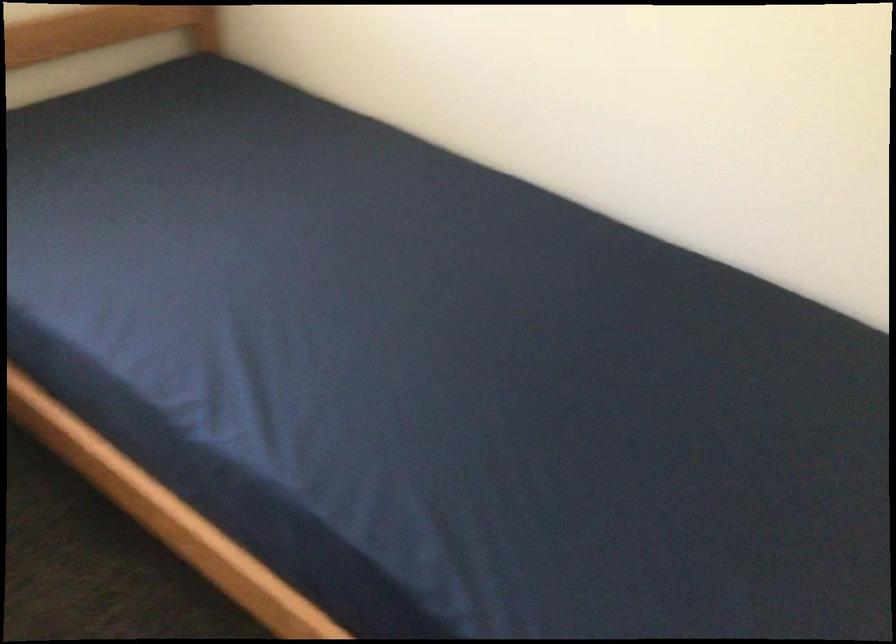
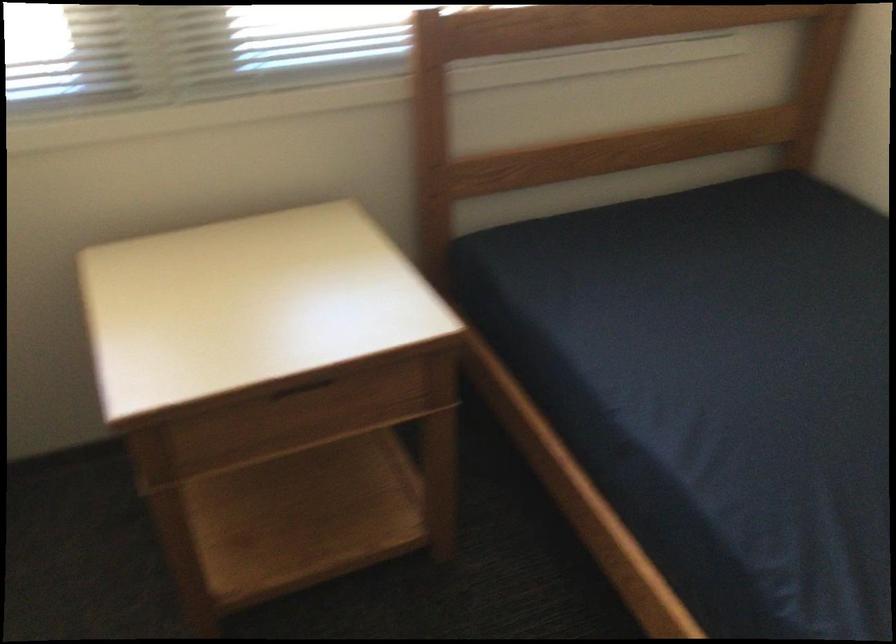
Question: How did the camera likely rotate?

Choices:
 (A) Left
 (B) Right
 (C) Up
 (D) Down

Answer: (A)